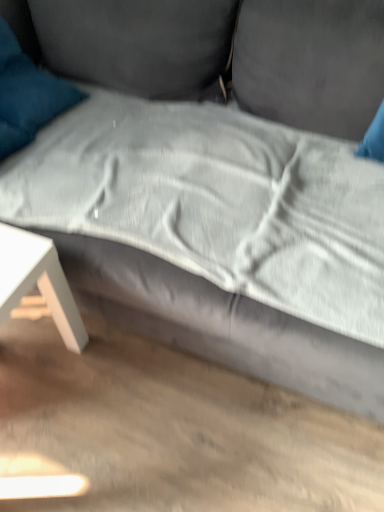
Locate an element on the screen. vacant space in white matte table at lower left (from a real-world perspective) is located at coordinates (23, 369).